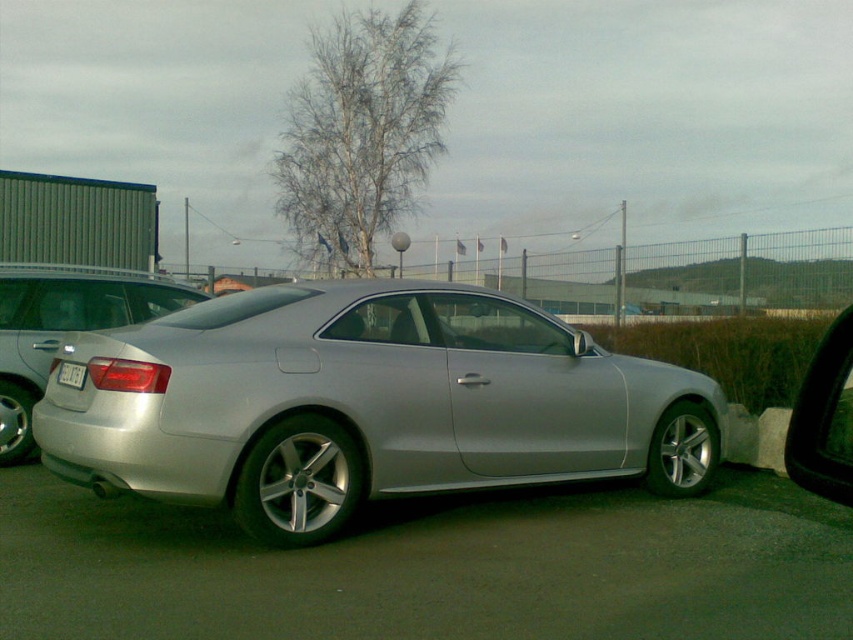
Question: Is satin silver car at center bigger than white plastic license plate at rear?

Choices:
 (A) no
 (B) yes

Answer: (B)

Question: Does silver metallic car at center come behind white plastic license plate at rear?

Choices:
 (A) no
 (B) yes

Answer: (A)

Question: Which object is the farthest from the white plastic license plate at rear?

Choices:
 (A) silver metallic car at center
 (B) black glossy view mirror at right
 (C) satin silver car at center

Answer: (B)

Question: Which object appears farthest from the camera in this image?

Choices:
 (A) black glossy view mirror at right
 (B) white plastic license plate at rear
 (C) silver metallic car at center
 (D) satin silver car at center

Answer: (D)

Question: Does black glossy view mirror at right have a smaller size compared to white plastic license plate at rear?

Choices:
 (A) yes
 (B) no

Answer: (B)

Question: Which of these objects is positioned closest to the satin silver car at center?

Choices:
 (A) white plastic license plate at rear
 (B) silver metallic car at center
 (C) black glossy view mirror at right

Answer: (A)